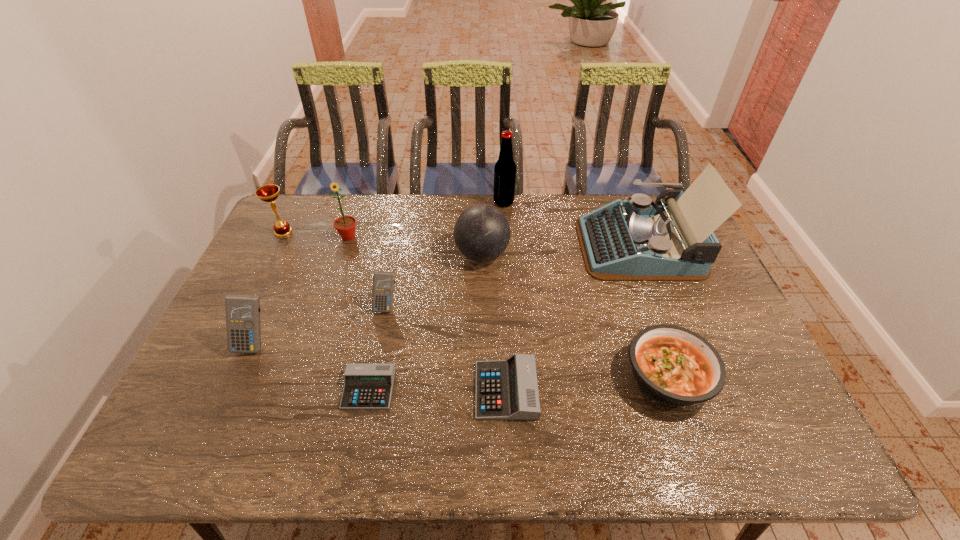
Locate an element on the screen. vacant space located on the grip area of the bowling ball is located at coordinates (331, 255).

I want to click on free space located 0.360m on the grip area of the bowling ball, so click(x=343, y=255).

At what (x,y) coordinates should I click in order to perform the action: click on vacant space located 0.390m on the grip area of the bowling ball. Please return your answer as a coordinate pair (x, y). Looking at the image, I should click on coord(334,255).

Locate an element on the screen. This screenshot has height=540, width=960. vacant space located 0.120m on the front of the chalice is located at coordinates (268, 263).

This screenshot has width=960, height=540. Identify the location of vacant space located 0.200m on the front-facing side of the nearer blue calculator. (215, 431).

The width and height of the screenshot is (960, 540). What are the coordinates of `vacant area situated on the front-facing side of the right blue calculator` in the screenshot? It's located at (376, 356).

This screenshot has height=540, width=960. I want to click on vacant space situated 0.070m on the back of the stew, so click(648, 322).

This screenshot has height=540, width=960. I want to click on vacant space situated on the right of the second shortest calculator, so click(x=680, y=390).

Image resolution: width=960 pixels, height=540 pixels. I want to click on free space located 0.050m on the front of the left gray calculator, so click(361, 430).

The width and height of the screenshot is (960, 540). Find the location of `beer bottle present at the far edge`. beer bottle present at the far edge is located at coordinates (505, 168).